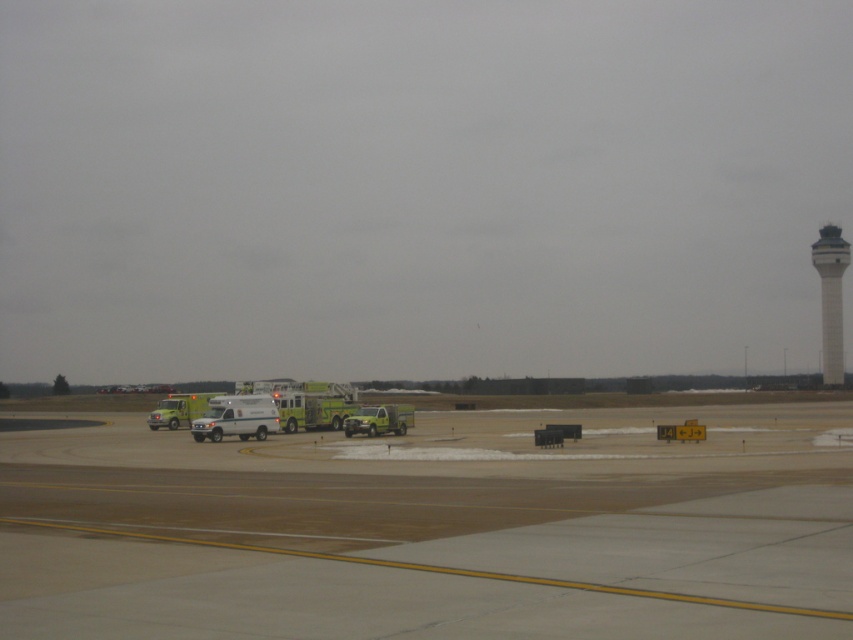
You are a pilot on the airport tarmac and need to determine which vehicle is taller between the green metallic fire truck at center and the green matte truck at center. Based on the scene, which one is taller?

The green metallic fire truck at center is taller than the green matte truck at center.